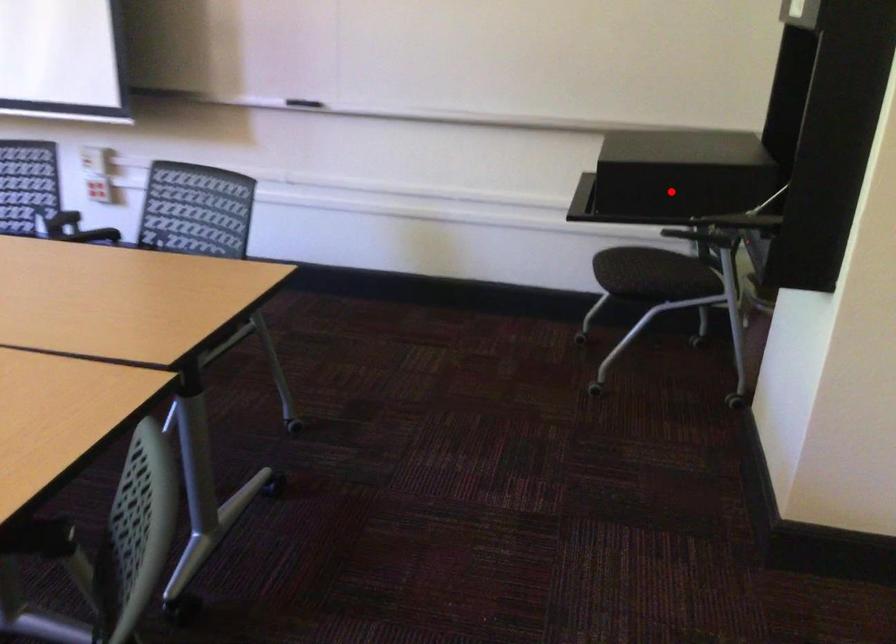
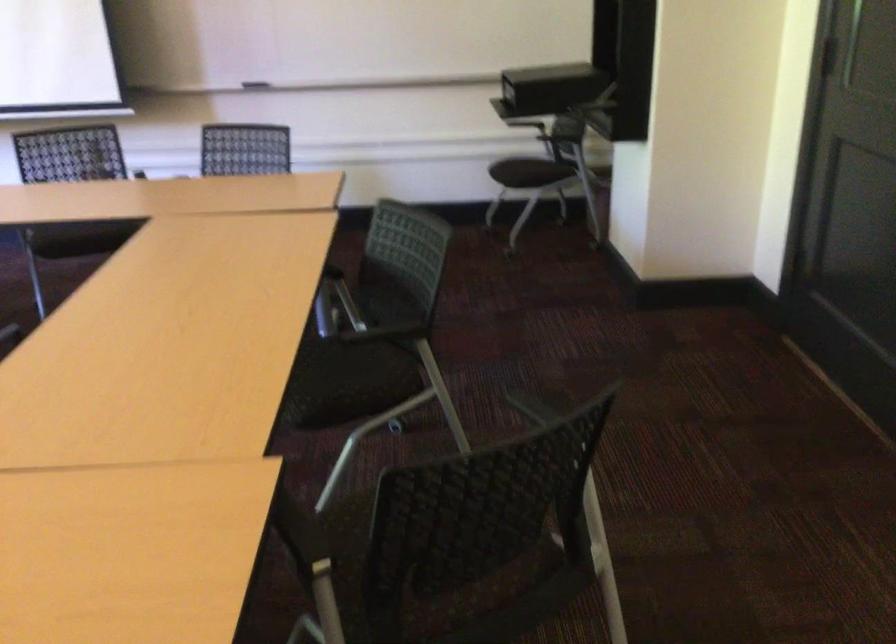
Question: I am providing you with two images of the same scene from different viewpoints. Given a red point in image1, look at the same physical point in image2. Is it:

Choices:
 (A) Closer to the viewpoint
 (B) Farther from the viewpoint

Answer: (B)